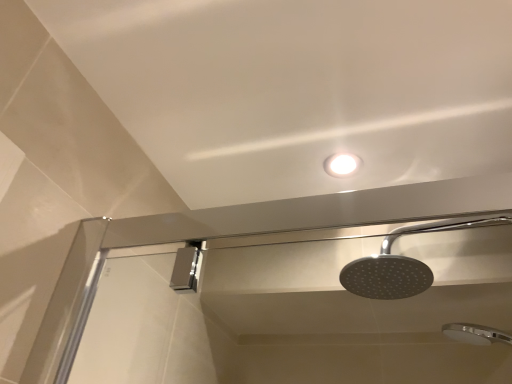
Measure the distance between white glossy light fixture at upper center and camera.

The distance of white glossy light fixture at upper center from camera is 37.19 inches.

In order to face white glossy light fixture at upper center, should I rotate leftwards or rightwards?

Rotate your view right by about 12.156°.

Identify the location of white glossy light fixture at upper center. (342, 164).

The height and width of the screenshot is (384, 512). What do you see at coordinates (342, 164) in the screenshot? I see `white glossy light fixture at upper center` at bounding box center [342, 164].

What are the coordinates of `white glossy light fixture at upper center` in the screenshot? It's located at (342, 164).